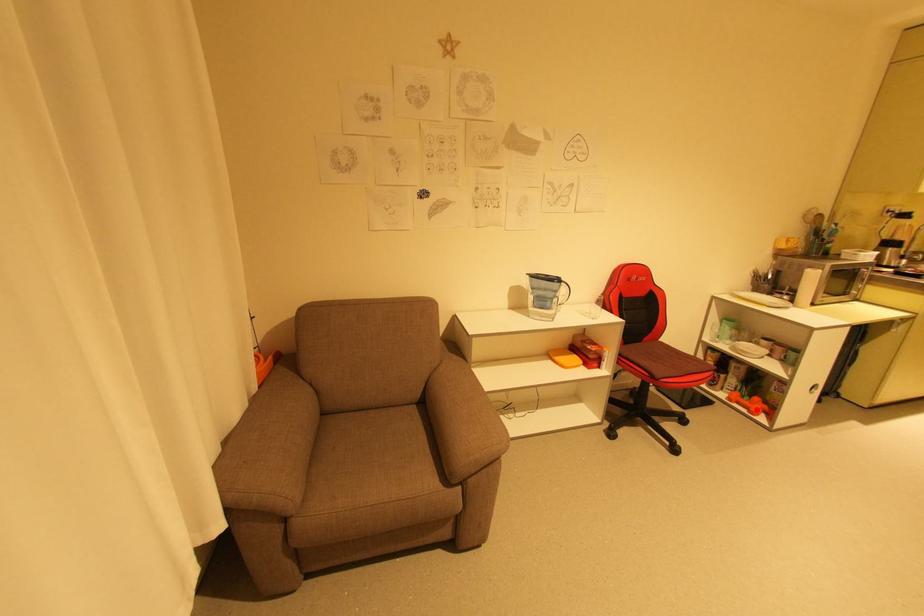
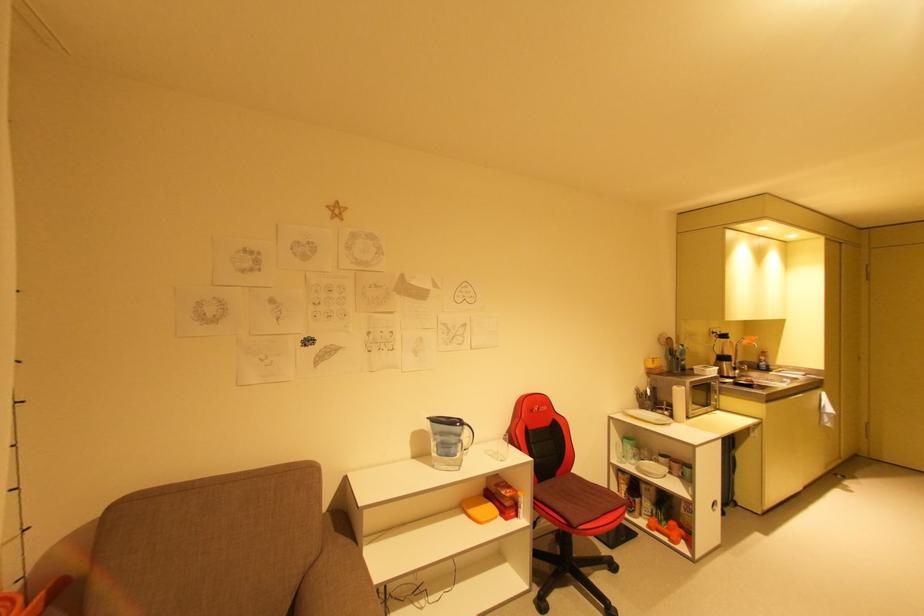
Question: I am providing you with two images of the same scene from different viewpoints. A red point is shown in image1. For the corresponding object point in image2, is it positioned nearer or farther from the camera?

Choices:
 (A) Nearer
 (B) Farther

Answer: (B)